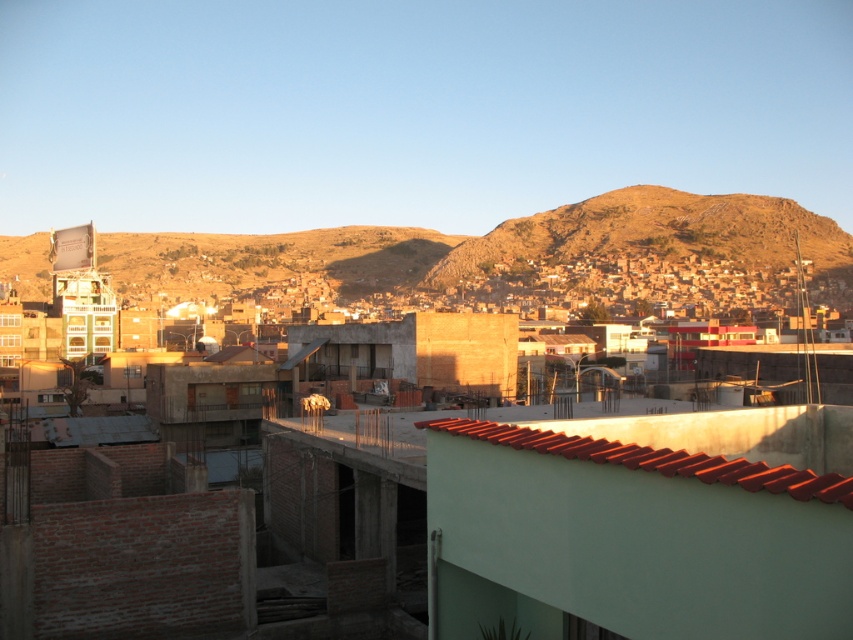
Looking at the urban scene, where is the brown rocky hillside at upper center located in relation to the red clay tiles at center?

The brown rocky hillside at upper center is located to the right of the red clay tiles at center.

You are a city planner assessing the urban layout. Considering the brown rocky hillside at upper center and the red clay tiles at center, which one is taller in the image?

The brown rocky hillside at upper center is taller than the red clay tiles at center.

You are a city planner standing at the base of the brown rocky hillside at upper center. You want to install a new observation deck that is 1.5 meters tall. Considering the current height of the hillside, will the deck be visible from the lower right corner where the red tiled roof building is located?

The brown rocky hillside at upper center is 223.63 meters away from the camera. Since the deck is only 1.5 meters tall, it will not be visible from the lower right corner where the red tiled roof building is located due to the distance and possible obstruction by other structures.